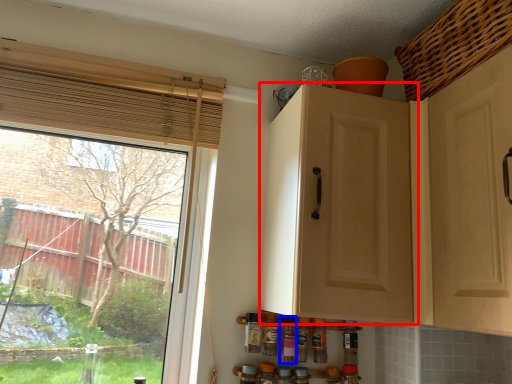
Question: Which object is further to the camera taking this photo, cabinetry (highlighted by a red box) or bottle (highlighted by a blue box)?

Choices:
 (A) cabinetry
 (B) bottle

Answer: (B)